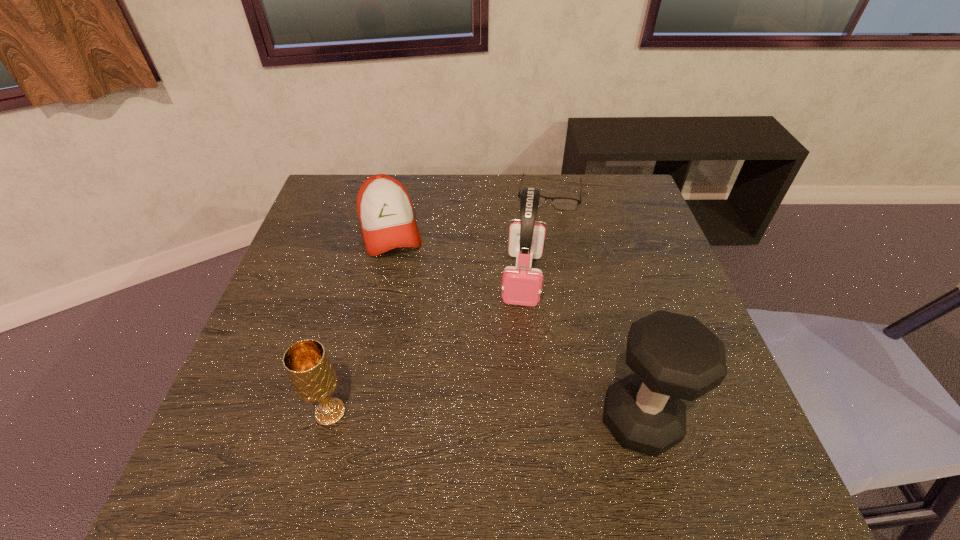
The image size is (960, 540). Find the location of `the third tallest object`. the third tallest object is located at coordinates (307, 364).

You are a GUI agent. You are given a task and a screenshot of the screen. Output one action in this format:
    pyautogui.click(x=<x>, y=<y>)
    Task: Click on the dumbbell
    The width and height of the screenshot is (960, 540).
    Given the screenshot: What is the action you would take?
    pyautogui.click(x=674, y=356)

Where is `earphone`? The height and width of the screenshot is (540, 960). earphone is located at coordinates (522, 286).

The height and width of the screenshot is (540, 960). In order to click on baseball cap in this screenshot , I will do `click(385, 212)`.

Find the location of `spectacles`. spectacles is located at coordinates (561, 203).

Image resolution: width=960 pixels, height=540 pixels. What are the coordinates of `free spot located 0.090m on the back of the third tallest object` in the screenshot? It's located at (344, 357).

Locate an element on the screen. vacant space located on the back of the dumbbell is located at coordinates (612, 321).

Where is `vacant region located on the outer surface of the earphone`? The height and width of the screenshot is (540, 960). vacant region located on the outer surface of the earphone is located at coordinates coord(519,342).

Locate an element on the screen. The image size is (960, 540). vacant space situated on the outer surface of the earphone is located at coordinates (516, 369).

Where is `vacant region located 0.280m on the outer surface of the earphone`? vacant region located 0.280m on the outer surface of the earphone is located at coordinates (512, 417).